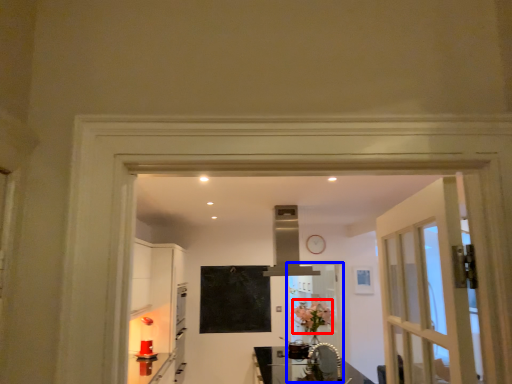
Question: Which point is further to the camera, flower (highlighted by a red box) or screen door (highlighted by a blue box)?

Choices:
 (A) flower
 (B) screen door

Answer: (B)